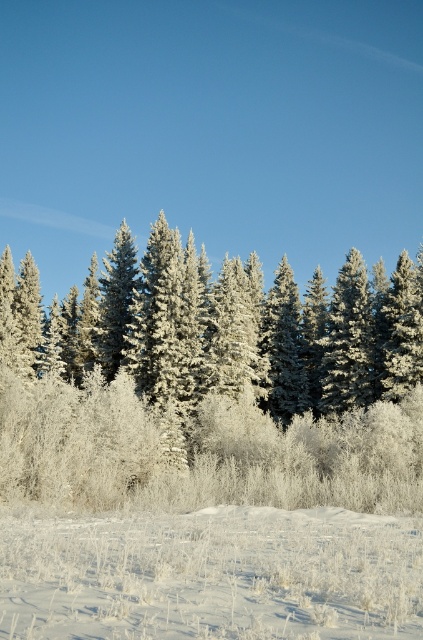
Question: Observing the image, what is the correct spatial positioning of frosted pine trees at center in reference to white frosty grass at lower center?

Choices:
 (A) left
 (B) right

Answer: (A)

Question: Can you confirm if frosted pine trees at center is positioned below white frosty grass at lower center?

Choices:
 (A) no
 (B) yes

Answer: (A)

Question: Does frosted pine trees at center have a smaller size compared to white frosty grass at lower center?

Choices:
 (A) no
 (B) yes

Answer: (A)

Question: Which of the following is the closest to the observer?

Choices:
 (A) (351, 579)
 (B) (263, 321)

Answer: (A)